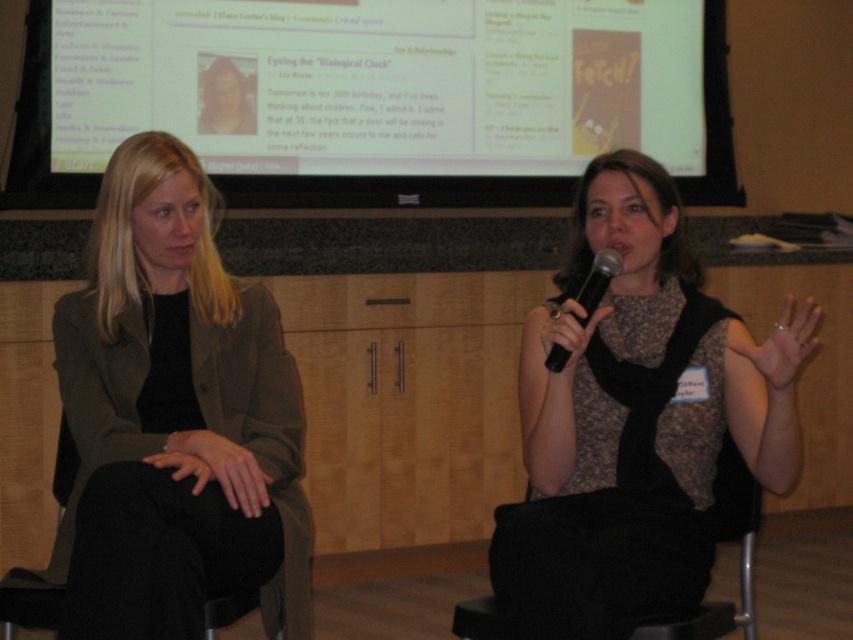
Between knitted scarf at center and black fabric chair at lower right, which one has more height?

With more height is knitted scarf at center.

Can you confirm if knitted scarf at center is taller than black fabric chair at lower right?

Yes, knitted scarf at center is taller than black fabric chair at lower right.

Measure the distance between knitted scarf at center and camera.

knitted scarf at center and camera are 5.03 feet apart from each other.

Locate an element on the screen. knitted scarf at center is located at coordinates (635, 420).

Is knitted scarf at center behind black plastic microphone at center?

No, it is in front of black plastic microphone at center.

Does point (607, 385) come in front of point (602, 276)?

No.

Between point (521, 429) and point (589, 282), which one is positioned behind?

Point (521, 429)

This screenshot has width=853, height=640. In order to click on knitted scarf at center in this screenshot , I will do `click(635, 420)`.

Which is more to the right, white glossy projection screen at upper center or knitted scarf at center?

From the viewer's perspective, knitted scarf at center appears more on the right side.

Which of these two, white glossy projection screen at upper center or knitted scarf at center, stands taller?

With more height is white glossy projection screen at upper center.

Looking at this image, who is more forward, (x=422, y=20) or (x=654, y=371)?

Point (x=654, y=371) is in front.

You are a GUI agent. You are given a task and a screenshot of the screen. Output one action in this format:
    pyautogui.click(x=<x>, y=<y>)
    Task: Click on the white glossy projection screen at upper center
    The image size is (853, 640).
    Given the screenshot: What is the action you would take?
    pyautogui.click(x=375, y=97)